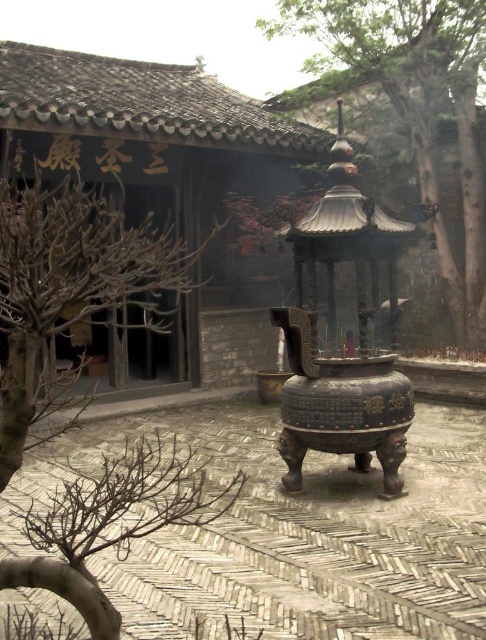
Measure the distance from bare branches at upper left to green textured tree at upper center.

The distance of bare branches at upper left from green textured tree at upper center is 7.88 meters.

Who is more distant from viewer, [1,467] or [416,33]?

The point [416,33] is more distant.

In order to click on bare branches at upper left in this screenshot , I will do `click(68, 285)`.